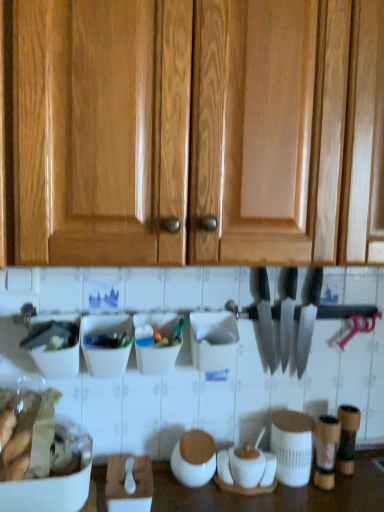
Question: Could you tell me if white matte jar at center, which is the second appliance in right-to-left order, is turned towards white matte jar at center, the first appliance when ordered from right to left?

Choices:
 (A) no
 (B) yes

Answer: (A)

Question: Considering the relative sizes of white matte jar at center, which is the second appliance in right-to-left order, and white matte jar at center, the 2th appliance in the left-to-right sequence, in the image provided, is white matte jar at center, which is the second appliance in right-to-left order, bigger than white matte jar at center, the 2th appliance in the left-to-right sequence,?

Choices:
 (A) yes
 (B) no

Answer: (B)

Question: Is white matte jar at center, which is the second appliance in right-to-left order, not near white matte jar at center, the 2th appliance in the left-to-right sequence?

Choices:
 (A) yes
 (B) no

Answer: (B)

Question: Considering the relative positions of white matte jar at center, the 1th appliance viewed from the left, and white matte jar at center, the first appliance when ordered from right to left, in the image provided, is white matte jar at center, the 1th appliance viewed from the left, in front of white matte jar at center, the first appliance when ordered from right to left,?

Choices:
 (A) yes
 (B) no

Answer: (A)

Question: From a real-world perspective, is white matte jar at center, the 1th appliance viewed from the left, over white matte jar at center, the first appliance when ordered from right to left?

Choices:
 (A) no
 (B) yes

Answer: (A)

Question: Considering the positions of white matte jar at center, the 1th appliance viewed from the left, and white matte jar at center, the first appliance when ordered from right to left, in the image, is white matte jar at center, the 1th appliance viewed from the left, taller or shorter than white matte jar at center, the first appliance when ordered from right to left,?

Choices:
 (A) tall
 (B) short

Answer: (B)

Question: Based on their sizes in the image, would you say white matte jar at center, which is the second appliance in right-to-left order, is bigger or smaller than white matte jar at center, the 2th appliance in the left-to-right sequence?

Choices:
 (A) small
 (B) big

Answer: (A)

Question: From the image's perspective, is white matte jar at center, which is the second appliance in right-to-left order, positioned above or below white matte jar at center, the 2th appliance in the left-to-right sequence?

Choices:
 (A) above
 (B) below

Answer: (B)

Question: In the image, is white matte jar at center, the 1th appliance viewed from the left, on the left side or the right side of white matte jar at center, the first appliance when ordered from right to left?

Choices:
 (A) right
 (B) left

Answer: (B)

Question: Looking at the image, does glossy wood cabinets at upper center seem bigger or smaller compared to polished silver knife at center, which is counted as the 2th knife, starting from the left?

Choices:
 (A) small
 (B) big

Answer: (B)

Question: In terms of width, does glossy wood cabinets at upper center look wider or thinner when compared to polished silver knife at center, which is counted as the 2th knife, starting from the left?

Choices:
 (A) wide
 (B) thin

Answer: (A)

Question: Visually, is glossy wood cabinets at upper center positioned to the left or to the right of polished silver knife at center, which is counted as the 2th knife, starting from the left?

Choices:
 (A) left
 (B) right

Answer: (A)

Question: Is glossy wood cabinets at upper center taller or shorter than polished silver knife at center, marked as the 1th knife in a right-to-left arrangement?

Choices:
 (A) short
 (B) tall

Answer: (B)

Question: In terms of width, does white matte jar at center, the 1th appliance viewed from the left, look wider or thinner when compared to polished silver knife at center, the 2th knife in the right-to-left sequence?

Choices:
 (A) wide
 (B) thin

Answer: (B)

Question: Does point (190, 459) appear closer or farther from the camera than point (258, 290)?

Choices:
 (A) closer
 (B) farther

Answer: (A)